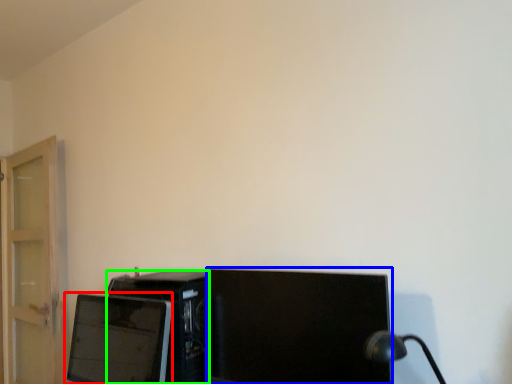
Question: Which object is the closest to the computer monitor (highlighted by a red box)? Choose among these: computer monitor (highlighted by a blue box) or desktop computer (highlighted by a green box).

Choices:
 (A) computer monitor
 (B) desktop computer

Answer: (B)